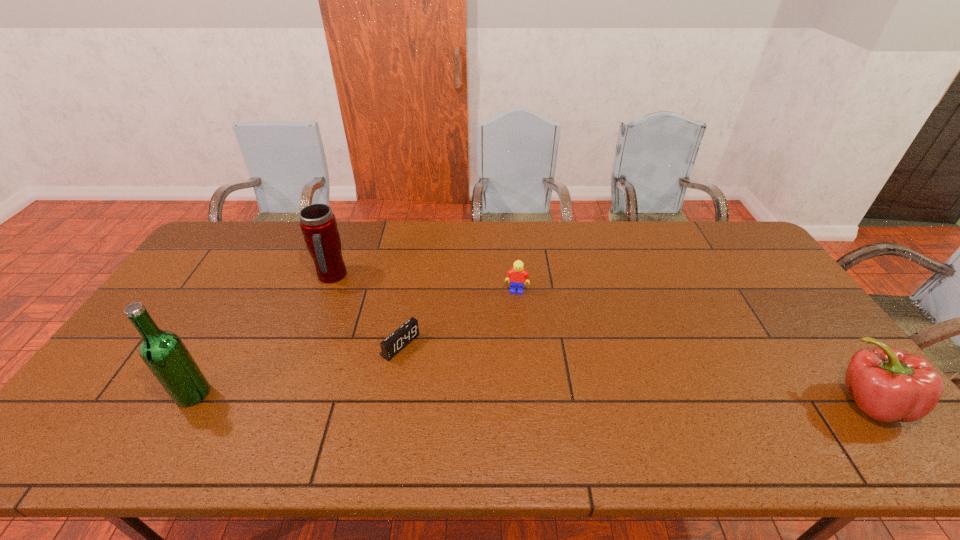
Identify the location of vacant space that's between the third object from left to right and the thermos bottle. The image size is (960, 540). (366, 311).

You are a GUI agent. You are given a task and a screenshot of the screen. Output one action in this format:
    pyautogui.click(x=<x>, y=<y>)
    Task: Click on the third closest object to the thermos bottle
    The width and height of the screenshot is (960, 540).
    Given the screenshot: What is the action you would take?
    pyautogui.click(x=516, y=276)

Find the location of a particular element. object that is the third closest to the Lego is located at coordinates (887, 384).

This screenshot has width=960, height=540. Find the location of `free space in the image that satisfies the following two spatial constraints: 1. on the front side of the pepper; 2. on the left side of the fourth object from right to left`. free space in the image that satisfies the following two spatial constraints: 1. on the front side of the pepper; 2. on the left side of the fourth object from right to left is located at coordinates (283, 402).